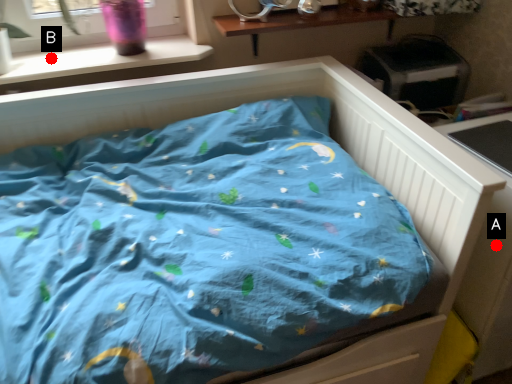
Question: Two points are circled on the image, labeled by A and B beside each circle. Among these points, which one is farthest from the camera?

Choices:
 (A) A is further
 (B) B is further

Answer: (B)